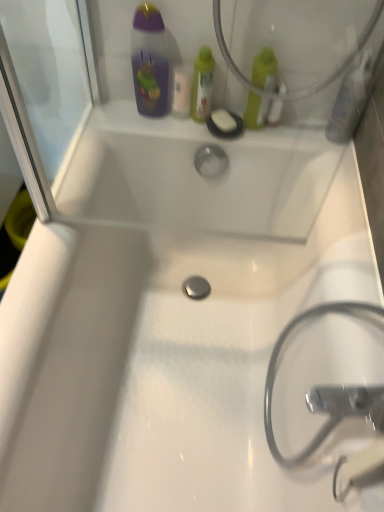
In order to click on free point in front of translucent plastic mouthwash at upper center, positioned as the first mouthwash in left-to-right order in this screenshot , I will do `click(181, 131)`.